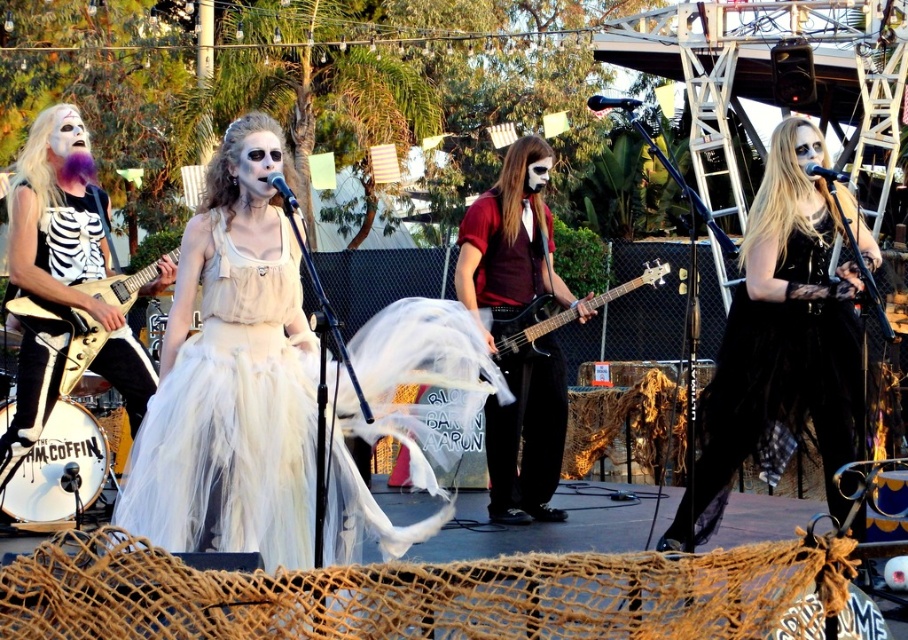
Who is lower down, matte red shirt at center or black matte bass guitar at center?

Positioned lower is matte red shirt at center.

Does matte red shirt at center appear over black matte bass guitar at center?

No.

What do you see at coordinates (507, 250) in the screenshot? This screenshot has height=640, width=908. I see `matte red shirt at center` at bounding box center [507, 250].

Locate an element on the screen. The width and height of the screenshot is (908, 640). matte red shirt at center is located at coordinates (507, 250).

Is black velvet dress at right below matte red shirt at center?

Indeed, black velvet dress at right is positioned under matte red shirt at center.

Who is more distant from viewer, (x=804, y=160) or (x=551, y=282)?

Point (x=551, y=282)

Find the location of a particular element. black velvet dress at right is located at coordinates (783, 333).

Is black velvet dress at right to the left of metallic gold electric guitar at left from the viewer's perspective?

In fact, black velvet dress at right is to the right of metallic gold electric guitar at left.

Image resolution: width=908 pixels, height=640 pixels. What do you see at coordinates (783, 333) in the screenshot? I see `black velvet dress at right` at bounding box center [783, 333].

The height and width of the screenshot is (640, 908). What are the coordinates of `black velvet dress at right` in the screenshot? It's located at (783, 333).